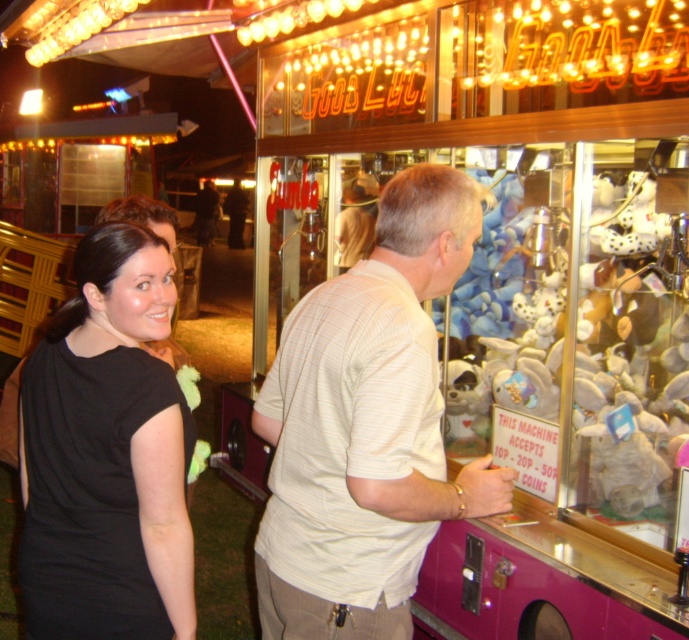
What are the coordinates of `light beige striped shirt at center` in the screenshot? It's located at [367, 426].

Consider the image. Is light beige striped shirt at center in front of black fabric dress at left?

That is True.

Identify the location of light beige striped shirt at center. (367, 426).

This screenshot has width=689, height=640. I want to click on light beige striped shirt at center, so click(x=367, y=426).